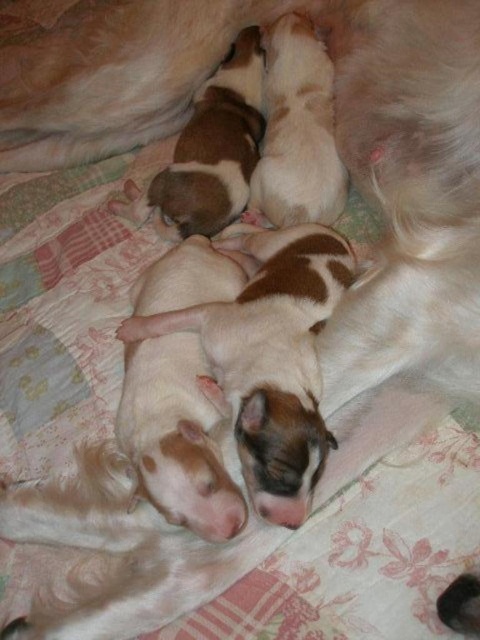
You are a photographer trying to capture the white fur puppies at center. According to the coordinates provided, where should you focus your camera lens to ensure the puppies are in the center of your photo?

You should focus your camera lens at the coordinates point (269, 358) to ensure the white fur puppies at center are in the center of your photo.

You are a veterinarian examining the image of the puppies. Based on the scene, which puppies are more likely to be older between the white fur puppies at center and the brown and white fur at center?

The white fur puppies at center are more likely to be older since they have a larger size compared to the brown and white fur at center.